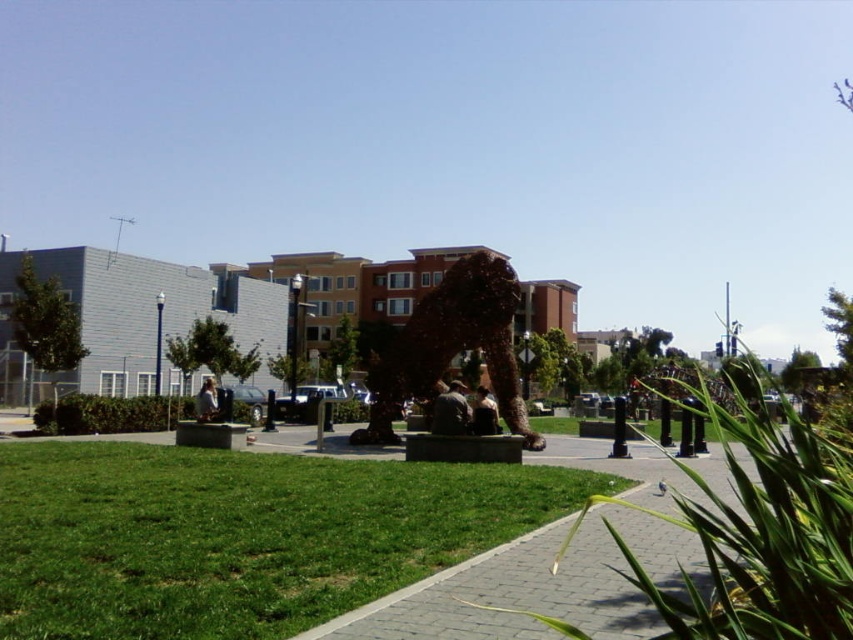
From the picture: Between green grass at lower left and brown textured sculpture at center, which one is positioned lower?

green grass at lower left is below.

Who is more forward, (491, 524) or (517, 404)?

Positioned in front is point (491, 524).

The width and height of the screenshot is (853, 640). In order to click on green grass at lower left in this screenshot , I will do `click(241, 534)`.

Is brick paved walkway at center bigger than brown textured sculpture at center?

No.

Is brick paved walkway at center thinner than brown textured sculpture at center?

Yes, brick paved walkway at center is thinner than brown textured sculpture at center.

Is point (735, 452) positioned in front of point (508, 392)?

Yes, point (735, 452) is in front of point (508, 392).

This screenshot has width=853, height=640. In order to click on brick paved walkway at center in this screenshot , I will do `click(534, 586)`.

Between green grass at lower left and brick paved walkway at center, which one is positioned lower?

brick paved walkway at center is lower down.

Does green grass at lower left have a lesser height compared to brick paved walkway at center?

Indeed, green grass at lower left has a lesser height compared to brick paved walkway at center.

Describe the element at coordinates (241, 534) in the screenshot. I see `green grass at lower left` at that location.

Locate an element on the screen. The width and height of the screenshot is (853, 640). green grass at lower left is located at coordinates (241, 534).